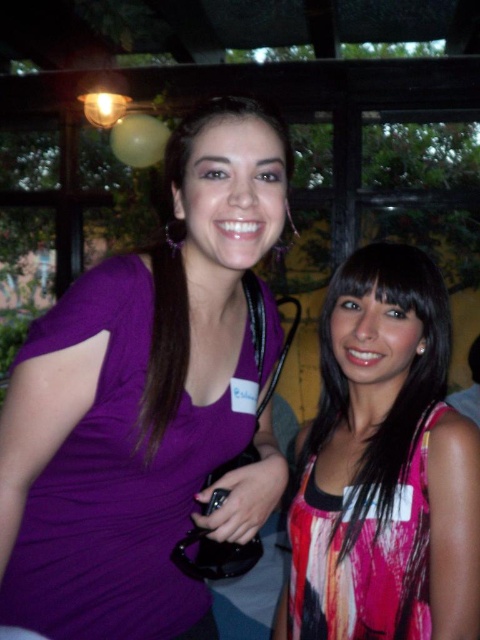
You are organizing a photo shoot and need to ensure that the purple matte shirt at center and the multicolored fabric dress at right are both visible in the frame. Which object should you prioritize positioning closer to the camera to maintain clarity and detail?

The purple matte shirt at center is bigger than the multicolored fabric dress at right, so you should prioritize positioning the purple matte shirt at center closer to the camera to maintain clarity and detail.